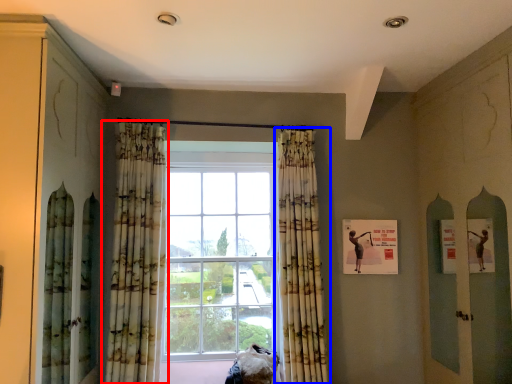
Question: Which point is further to the camera, curtain (highlighted by a red box) or curtain (highlighted by a blue box)?

Choices:
 (A) curtain
 (B) curtain

Answer: (B)